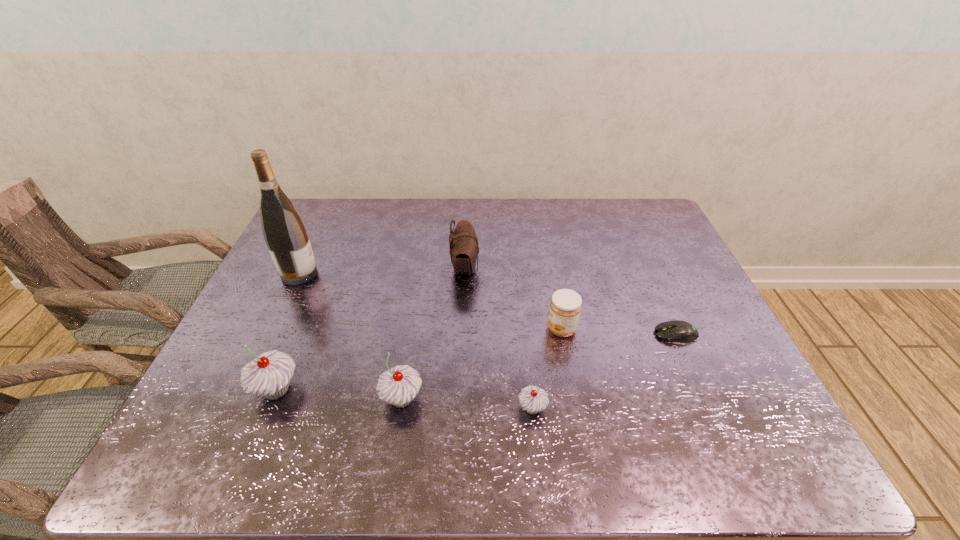
I want to click on vacant area between the leftmost cupcake and the second cupcake from left to right, so click(x=339, y=394).

The image size is (960, 540). Identify the location of vacant space in between the fourth object from right to left and the rightmost cupcake. (498, 338).

I want to click on unoccupied area between the leftmost cupcake and the jam, so click(x=419, y=360).

This screenshot has width=960, height=540. In order to click on free space between the wine bottle and the computer mouse in this screenshot , I will do `click(488, 304)`.

Locate an element on the screen. This screenshot has height=540, width=960. vacant area that lies between the computer mouse and the leftmost cupcake is located at coordinates (476, 362).

At what (x,y) coordinates should I click in order to perform the action: click on vacant space in between the second cupcake from left to right and the wine bottle. Please return your answer as a coordinate pair (x, y). Looking at the image, I should click on (350, 336).

At what (x,y) coordinates should I click in order to perform the action: click on vacant area between the jam and the second cupcake from left to right. Please return your answer as a coordinate pair (x, y). Looking at the image, I should click on tap(482, 364).

What are the coordinates of `unoccupied position between the second cupcake from left to right and the rightmost cupcake` in the screenshot? It's located at (468, 403).

Image resolution: width=960 pixels, height=540 pixels. I want to click on vacant space in between the fourth object from left to right and the leftmost cupcake, so (x=371, y=329).

I want to click on free area in between the jam and the second shortest cupcake, so click(482, 364).